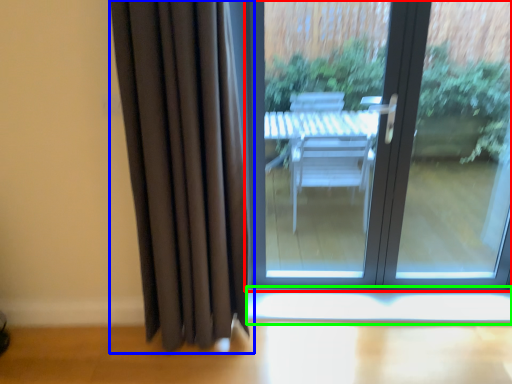
Question: Estimate the real-world distances between objects in this image. Which object is farther from door (highlighted by a red box), curtain (highlighted by a blue box) or window sill (highlighted by a green box)?

Choices:
 (A) curtain
 (B) window sill

Answer: (A)